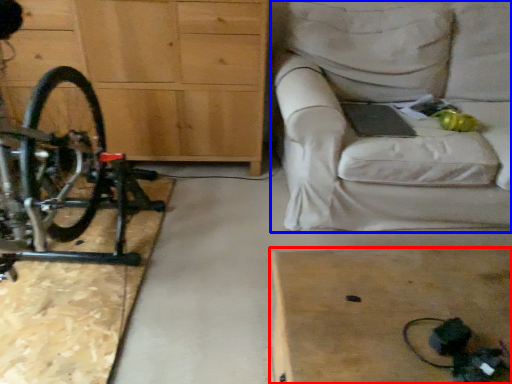
Question: Which object appears closest to the camera in this image, table (highlighted by a red box) or studio couch (highlighted by a blue box)?

Choices:
 (A) table
 (B) studio couch

Answer: (A)